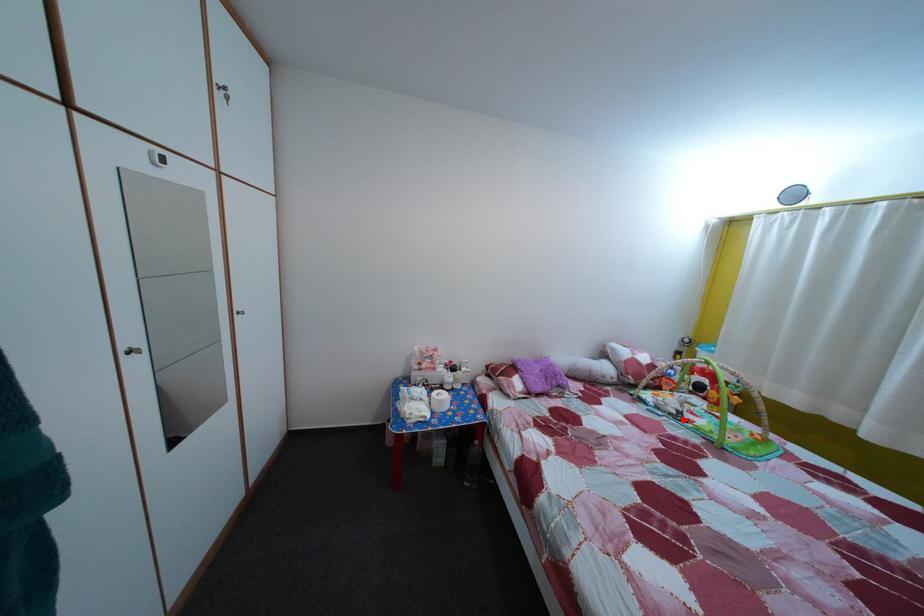
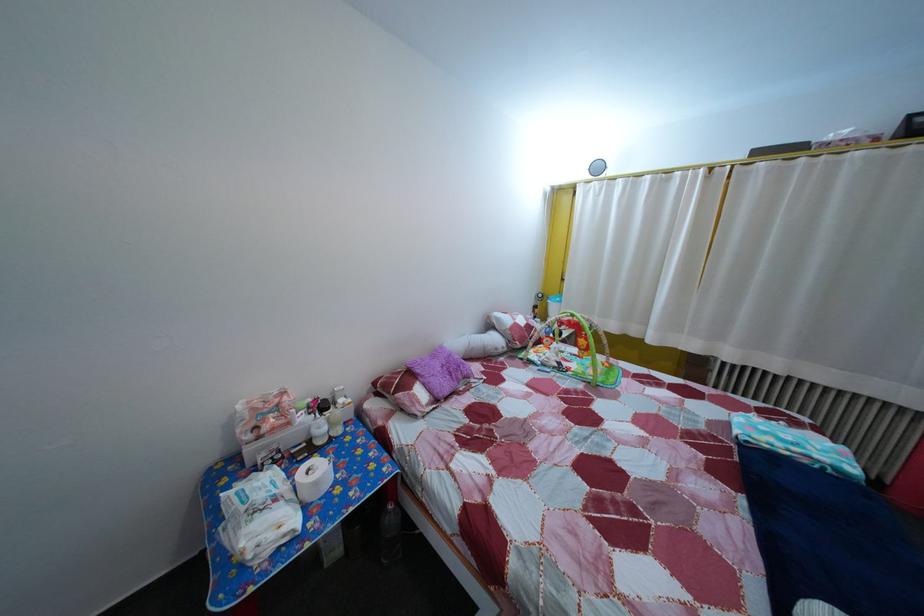
In the second image, find the point that corresponds to the highlighted location in the first image.

(565, 371)